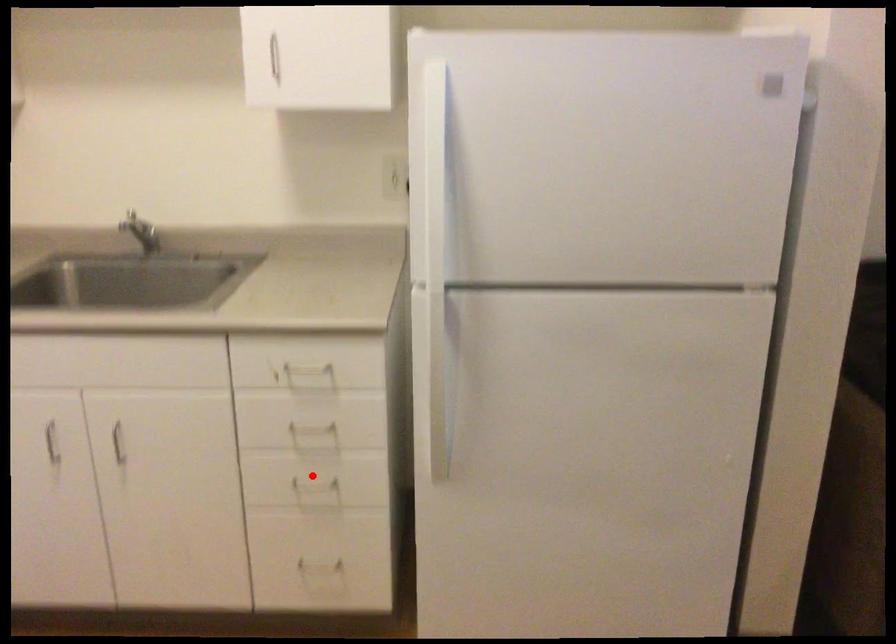
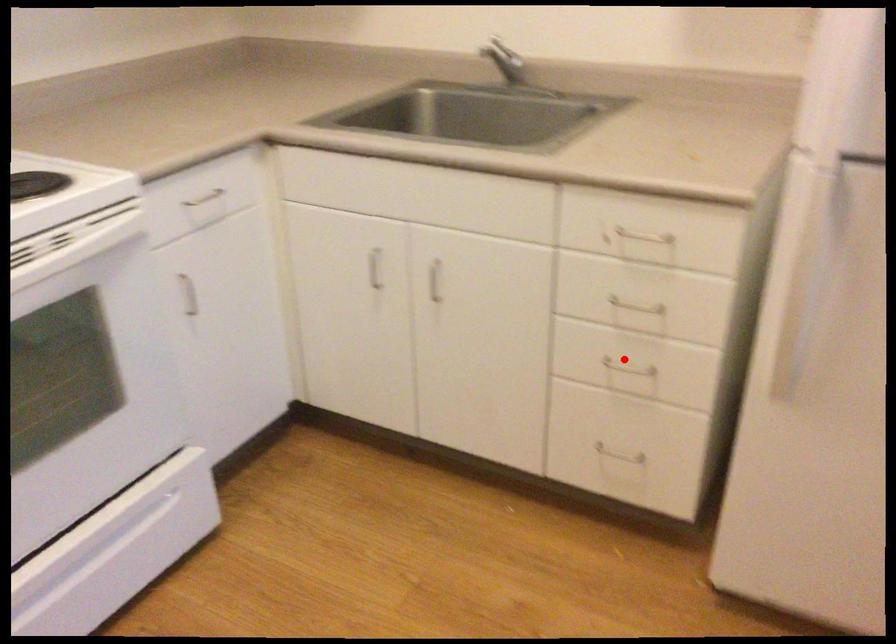
I am providing you with two images of the same scene from different viewpoints. A red point is marked on the first image and another point is marked on the second image. Do the highlighted points in image1 and image2 indicate the same real-world spot?

Yes